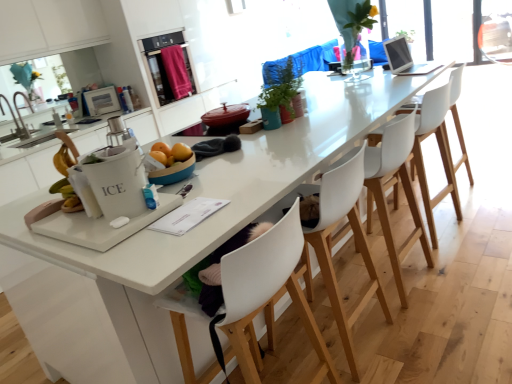
Question: From a real-world perspective, is white matte ice bucket at center, the third appliance when ordered from back to front, physically located above or below white plastic chair at center, which is the 2th chair from back to front?

Choices:
 (A) above
 (B) below

Answer: (A)

Question: From their relative heights in the image, would you say white matte ice bucket at center, the first appliance positioned from the bottom, is taller or shorter than white plastic chair at center, the 4th chair viewed from the front?

Choices:
 (A) short
 (B) tall

Answer: (A)

Question: Which of these objects is positioned farthest from the white matte ice bucket at center, arranged as the 2th appliance when viewed from the right?

Choices:
 (A) white plastic chair at center, acting as the first chair starting from the front
 (B) green matte plant at center
 (C) brushed metal faucet at left
 (D) white plastic chair at right, the 5th chair in the front-to-back sequence
 (E) metallic stainless steel oven at upper center

Answer: (E)

Question: Estimate the real-world distances between objects in this image. Which object is closer to the white plastic chair at center, which is the 2th chair from back to front?

Choices:
 (A) green matte plant at center
 (B) brushed metal faucet at left
 (C) white plastic chair at right, the 5th chair in the front-to-back sequence
 (D) white glossy microwave at upper left, which appears as the 1th appliance when viewed from the left
 (E) metallic stainless steel oven at upper center

Answer: (C)